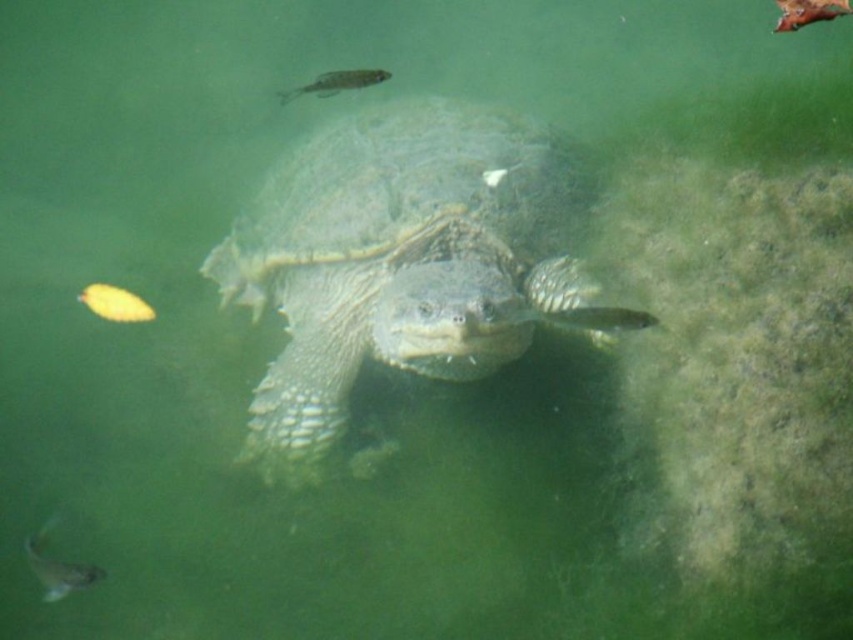
You are an underwater photographer aiming to capture a closeup of the yellow matte fish at lower left and the shiny silver fish at upper center. Which fish should you choose to fit entirely within your camera frame if your frame can only accommodate the smaller of the two?

You should choose the shiny silver fish at upper center because the yellow matte fish at lower left is wider than the shiny silver fish at upper center, making the latter smaller and easier to fit within the camera frame.